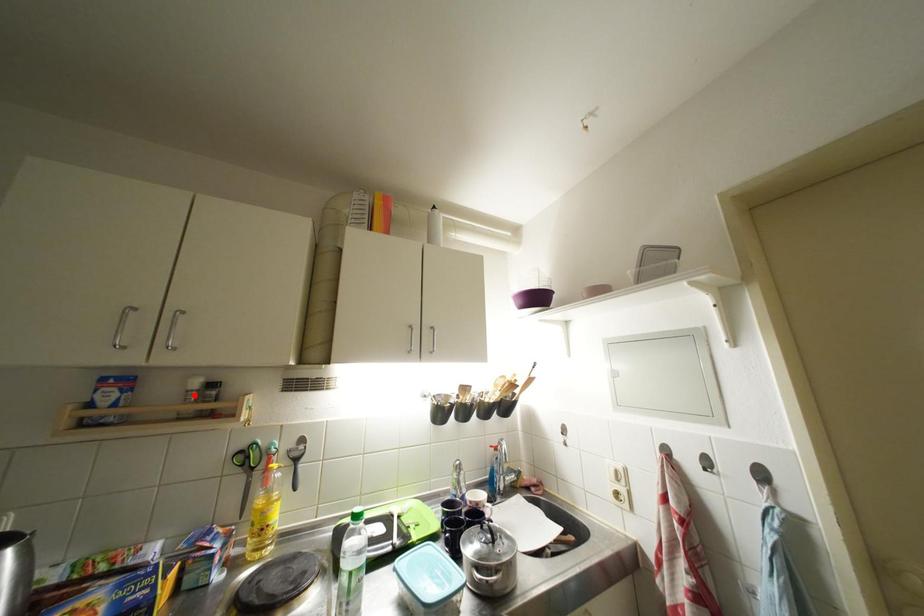
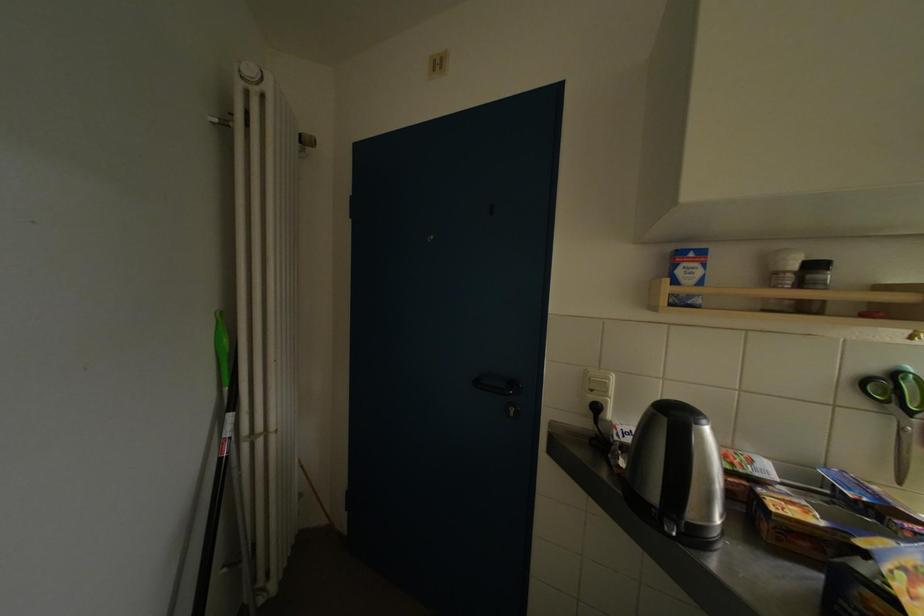
The point at the highlighted location is marked in the first image. Where is the corresponding point in the second image?

(784, 277)